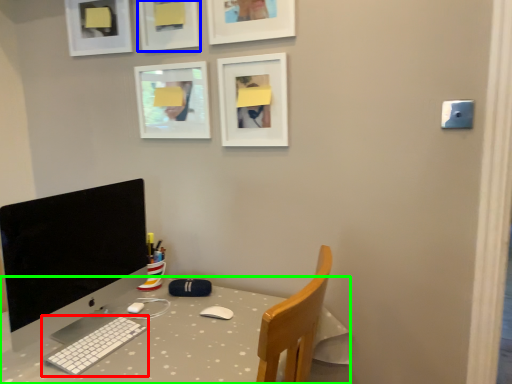
Question: Which object is positioned closest to computer keyboard (highlighted by a red box)? Select from picture frame (highlighted by a blue box) and desk (highlighted by a green box).

Choices:
 (A) picture frame
 (B) desk

Answer: (B)